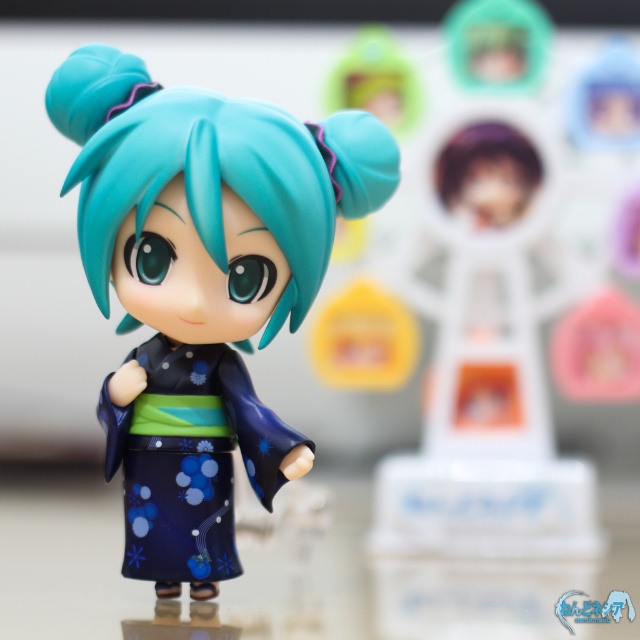
Question: Which object is closer to the camera taking this photo?

Choices:
 (A) blue satin kimono at center
 (B) matte blue kimono doll at center

Answer: (B)

Question: Does matte blue kimono doll at center have a larger size compared to purple matte hair at upper center?

Choices:
 (A) yes
 (B) no

Answer: (A)

Question: Which point is farther to the camera?

Choices:
 (A) blue satin kimono at center
 (B) purple matte hair at upper center
 (C) matte blue kimono doll at center

Answer: (B)

Question: Can you confirm if matte blue kimono doll at center is wider than blue satin kimono at center?

Choices:
 (A) yes
 (B) no

Answer: (A)

Question: Can you confirm if matte blue kimono doll at center is positioned above purple matte hair at upper center?

Choices:
 (A) yes
 (B) no

Answer: (B)

Question: Among these objects, which one is nearest to the camera?

Choices:
 (A) blue satin kimono at center
 (B) purple matte hair at upper center

Answer: (A)